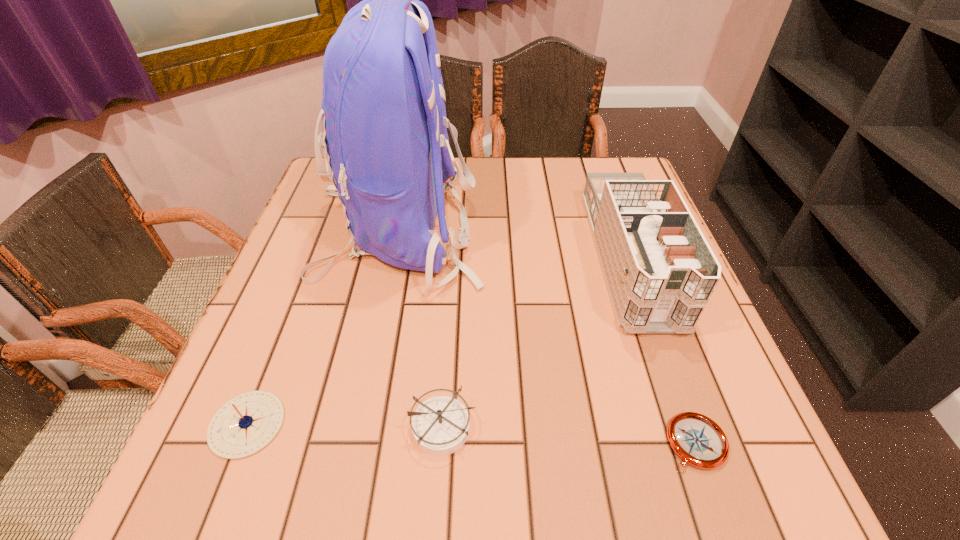
In order to click on empty location between the leftmost compass and the fourth shortest object in this screenshot , I will do `click(438, 341)`.

Locate an element on the screen. vacant area that lies between the leftmost compass and the tallest object is located at coordinates (323, 327).

In order to click on free spot between the second compass from right to left and the shortest compass in this screenshot , I will do `click(570, 435)`.

Locate an element on the screen. unoccupied position between the second compass from right to left and the backpack is located at coordinates (420, 328).

I want to click on unoccupied position between the tallest object and the second compass from right to left, so click(420, 328).

Image resolution: width=960 pixels, height=540 pixels. Identify the location of unoccupied area between the second compass from left to right and the shortest compass. (570, 435).

Where is `free space between the tallest object and the second compass from right to left`? free space between the tallest object and the second compass from right to left is located at coordinates (420, 328).

Choose which object is the third nearest neighbor to the leftmost compass. Please provide its 2D coordinates. Your answer should be formatted as a tuple, i.e. [(x, y)], where the tuple contains the x and y coordinates of a point satisfying the conditions above.

[(660, 271)]

Identify the location of object that ranks as the second closest to the shortest object. This screenshot has height=540, width=960. (440, 425).

Locate which compass is the second closest to the leftmost compass. Please provide its 2D coordinates. Your answer should be formatted as a tuple, i.e. [(x, y)], where the tuple contains the x and y coordinates of a point satisfying the conditions above.

[(699, 441)]